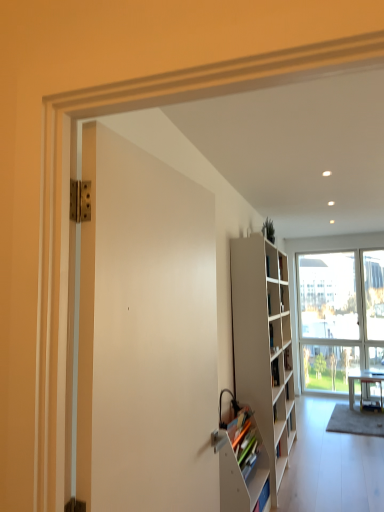
Question: From a real-world perspective, is white glass window at center under white matte bookshelf at right?

Choices:
 (A) yes
 (B) no

Answer: (B)

Question: From the image's perspective, is white glass window at center above white matte bookshelf at right?

Choices:
 (A) no
 (B) yes

Answer: (A)

Question: Is white glass window at center taller than white matte bookshelf at right?

Choices:
 (A) no
 (B) yes

Answer: (B)

Question: Is white glass window at center further to camera compared to white matte bookshelf at right?

Choices:
 (A) yes
 (B) no

Answer: (A)

Question: Can you confirm if white glass window at center is wider than white matte bookshelf at right?

Choices:
 (A) yes
 (B) no

Answer: (B)

Question: Considering the positions of gray carpet at lower right and white matte bookshelf at right in the image, is gray carpet at lower right wider or thinner than white matte bookshelf at right?

Choices:
 (A) thin
 (B) wide

Answer: (B)

Question: From their relative heights in the image, would you say gray carpet at lower right is taller or shorter than white matte bookshelf at right?

Choices:
 (A) tall
 (B) short

Answer: (B)

Question: In terms of size, does gray carpet at lower right appear bigger or smaller than white matte bookshelf at right?

Choices:
 (A) small
 (B) big

Answer: (A)

Question: Considering their positions, is gray carpet at lower right located in front of or behind white matte bookshelf at right?

Choices:
 (A) front
 (B) behind

Answer: (B)

Question: From a real-world perspective, is white matte door at center physically located above or below white matte bookshelf at lower right?

Choices:
 (A) above
 (B) below

Answer: (A)

Question: Do you think white matte door at center is within white matte bookshelf at lower right, or outside of it?

Choices:
 (A) outside
 (B) inside

Answer: (A)

Question: Considering the positions of white matte door at center and white matte bookshelf at lower right in the image, is white matte door at center taller or shorter than white matte bookshelf at lower right?

Choices:
 (A) tall
 (B) short

Answer: (A)

Question: Is point (206, 406) closer or farther from the camera than point (249, 474)?

Choices:
 (A) farther
 (B) closer

Answer: (B)

Question: Looking at their shapes, would you say white glossy desk at lower right is wider or thinner than green matte plant at upper center?

Choices:
 (A) wide
 (B) thin

Answer: (A)

Question: Considering the relative positions of white glossy desk at lower right and green matte plant at upper center in the image provided, is white glossy desk at lower right to the left or to the right of green matte plant at upper center?

Choices:
 (A) right
 (B) left

Answer: (A)